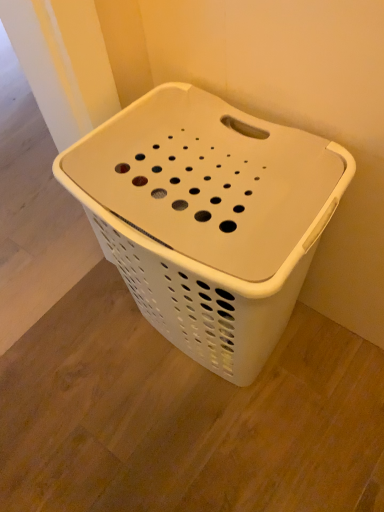
Find the location of a particular element. The image size is (384, 512). free region on the left part of white plastic laundry basket at center is located at coordinates pyautogui.click(x=87, y=377).